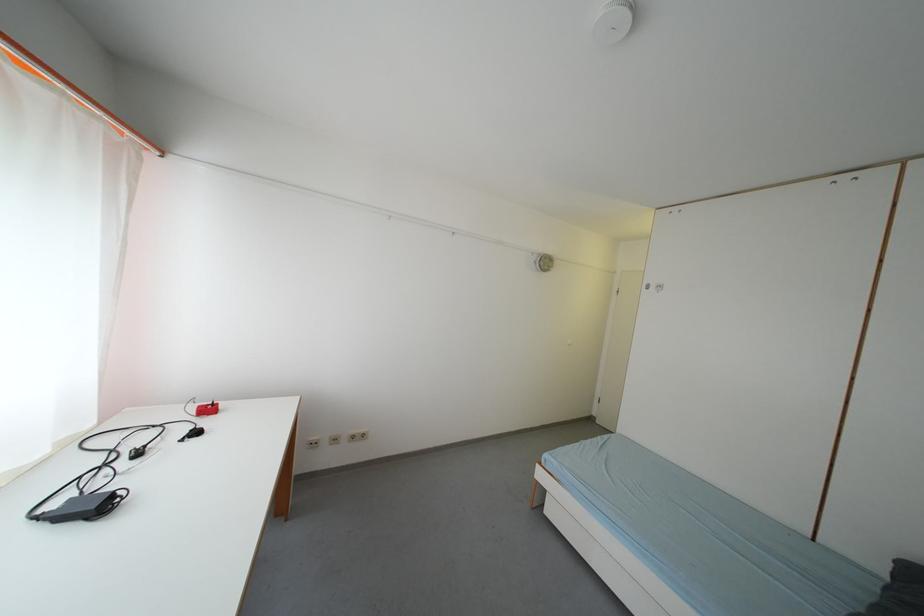
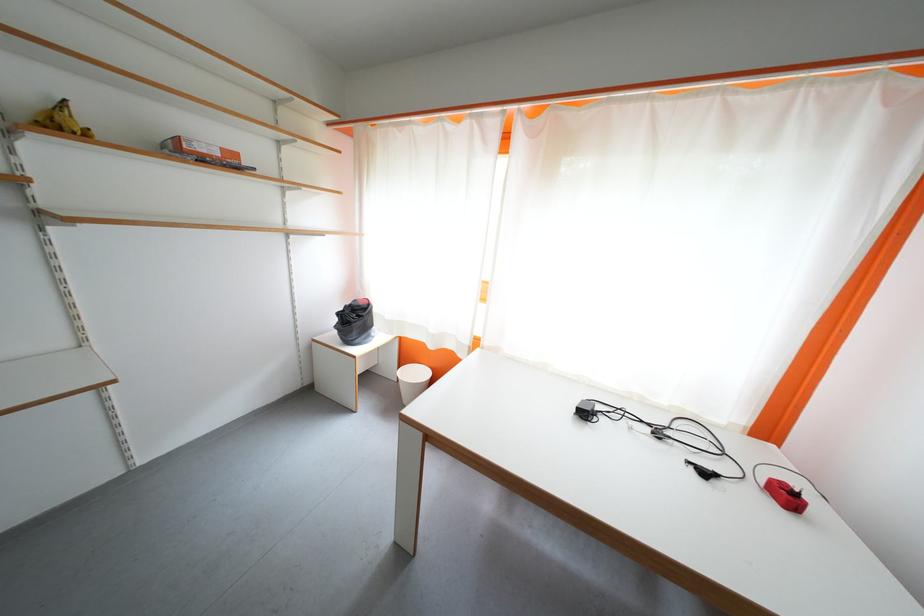
Find the pixel in the second image that matches the point at 205,436 in the first image.

(713, 477)